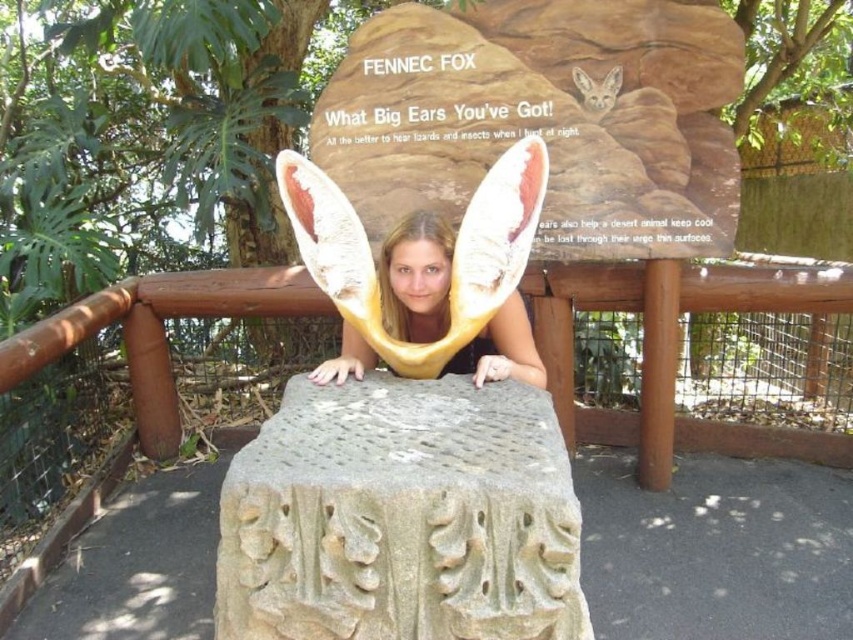
Question: Among these points, which one is nearest to the camera?

Choices:
 (A) (432, 483)
 (B) (277, 310)
 (C) (450, 362)

Answer: (A)

Question: Which of these objects is positioned closest to the matte yellow ears at center?

Choices:
 (A) brown wooden rail at center
 (B) gray rough stone at center

Answer: (B)

Question: Which of the following is the closest to the observer?

Choices:
 (A) (558, 429)
 (B) (200, 292)

Answer: (A)

Question: Can you confirm if gray rough stone at center is positioned to the left of matte yellow ears at center?

Choices:
 (A) no
 (B) yes

Answer: (B)

Question: Is gray rough stone at center bigger than brown wooden rail at center?

Choices:
 (A) no
 (B) yes

Answer: (A)

Question: Can you confirm if gray rough stone at center is positioned to the right of brown wooden rail at center?

Choices:
 (A) no
 (B) yes

Answer: (A)